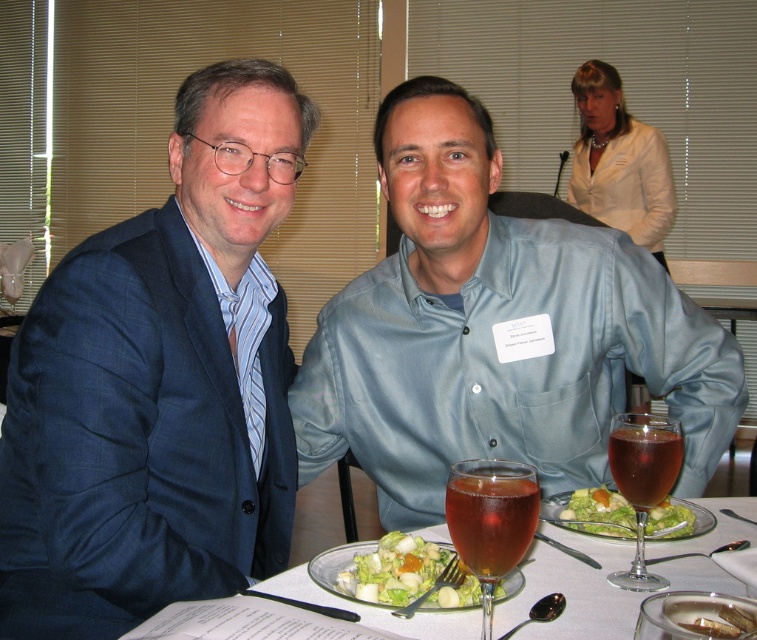
Question: Where is translucent glass plate at center located in relation to fresh green salad at center in the image?

Choices:
 (A) above
 (B) below

Answer: (B)

Question: Which point is farther to the camera?

Choices:
 (A) (668, 468)
 (B) (488, 548)

Answer: (A)

Question: Which object appears closest to the camera in this image?

Choices:
 (A) translucent amber liquid at center
 (B) green leafy salad at center
 (C) blue textured suit at left
 (D) translucent glass wine glass at center

Answer: (D)

Question: Does translucent glass wine at center appear under green leafy salad at center?

Choices:
 (A) yes
 (B) no

Answer: (B)

Question: Can you confirm if light blue shirt at center is positioned to the left of translucent amber liquid at center?

Choices:
 (A) no
 (B) yes

Answer: (B)

Question: Which is farther from the light blue shirt at center?

Choices:
 (A) green leafy salad at center
 (B) translucent glass plate at center

Answer: (B)